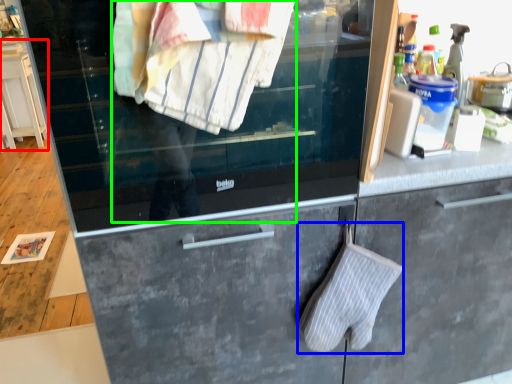
Question: Considering the real-world distances, which object is farthest from dresser (highlighted by a red box)? bath towel (highlighted by a blue box) or person (highlighted by a green box)?

Choices:
 (A) bath towel
 (B) person

Answer: (A)